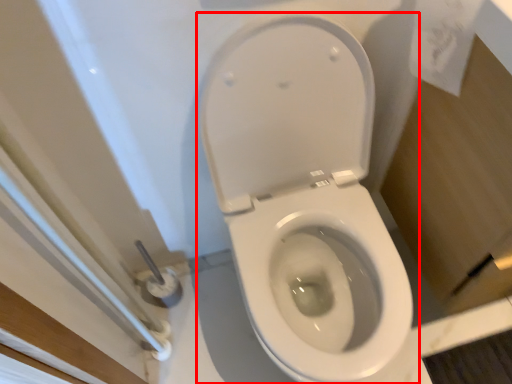
Question: From the image's perspective, what is the correct spatial relationship of toilet (annotated by the red box) in relation to toilet paper?

Choices:
 (A) below
 (B) above

Answer: (A)